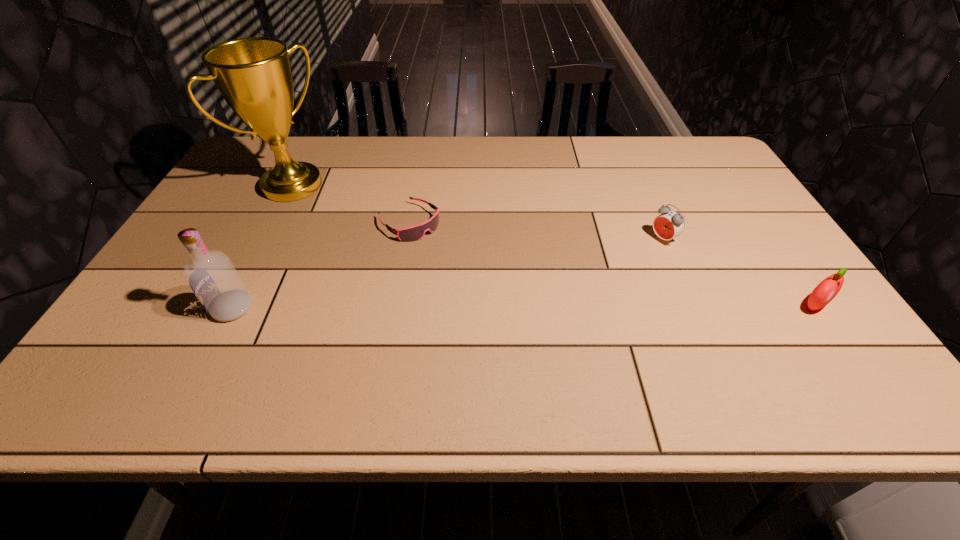
You are a GUI agent. You are given a task and a screenshot of the screen. Output one action in this format:
    pyautogui.click(x=<x>, y=<y>)
    Task: Click on the fourth shortest object
    The width and height of the screenshot is (960, 540).
    Given the screenshot: What is the action you would take?
    pyautogui.click(x=211, y=275)

Where is `apple`? The image size is (960, 540). apple is located at coordinates [x=826, y=290].

At what (x,y) coordinates should I click in order to perform the action: click on goggles. Please return your answer as a coordinate pair (x, y). Looking at the image, I should click on (414, 233).

Identify the location of the third object from right to left. The width and height of the screenshot is (960, 540). pyautogui.click(x=414, y=233).

Where is `the fourth object from left to right`? The image size is (960, 540). the fourth object from left to right is located at coordinates (670, 224).

Find the location of a particular element. The height and width of the screenshot is (540, 960). award is located at coordinates (253, 74).

This screenshot has width=960, height=540. I want to click on free space located on the label of the vodka, so click(181, 308).

Where is `vacant area situated on the label of the vodka`? The height and width of the screenshot is (540, 960). vacant area situated on the label of the vodka is located at coordinates (151, 308).

Identify the location of blank area located on the back of the rightmost object. This screenshot has width=960, height=540. (784, 262).

At what (x,y) coordinates should I click in order to perform the action: click on vacant space located on the front-facing side of the shortest object. Please return your answer as a coordinate pair (x, y). Looking at the image, I should click on (525, 317).